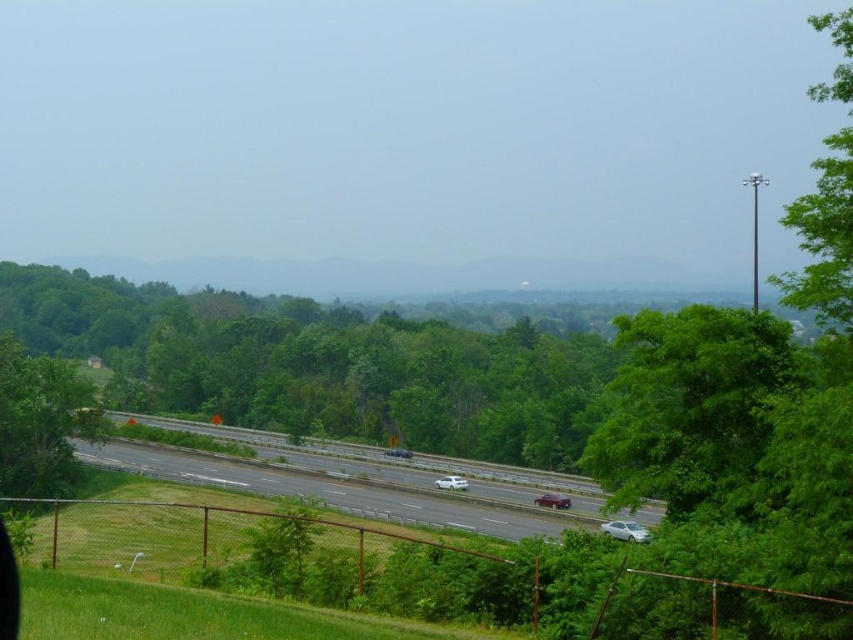
Question: Is green leafy tree at right closer to the viewer compared to shiny red sedan at center?

Choices:
 (A) yes
 (B) no

Answer: (A)

Question: Among these points, which one is nearest to the camera?

Choices:
 (A) (10, 608)
 (B) (16, 445)
 (C) (198, 458)

Answer: (A)

Question: Is green leafy tree at center below white glossy sedan at center?

Choices:
 (A) yes
 (B) no

Answer: (B)

Question: Does black matte view mirror at lower left lie behind white glossy sedan at lower right?

Choices:
 (A) no
 (B) yes

Answer: (A)

Question: Which is nearer to the green leafy tree at center?

Choices:
 (A) gray asphalt highway at center
 (B) green leafy tree at right
 (C) black matte view mirror at lower left

Answer: (A)

Question: Which object appears closest to the camera in this image?

Choices:
 (A) green leafy tree at center
 (B) black matte view mirror at lower left
 (C) shiny red sedan at center
 (D) white glossy sedan at center

Answer: (B)